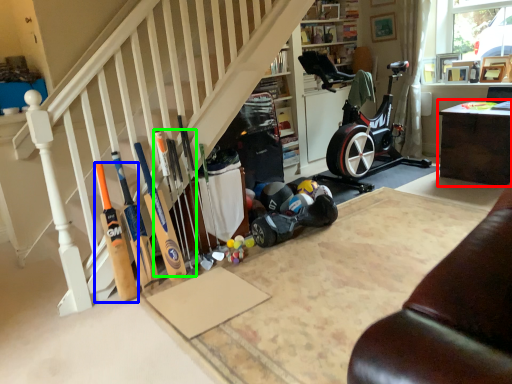
Question: Based on their relative distances, which object is nearer to table (highlighted by a red box)? Choose from baseball bat (highlighted by a blue box) and baseball bat (highlighted by a green box).

Choices:
 (A) baseball bat
 (B) baseball bat

Answer: (B)